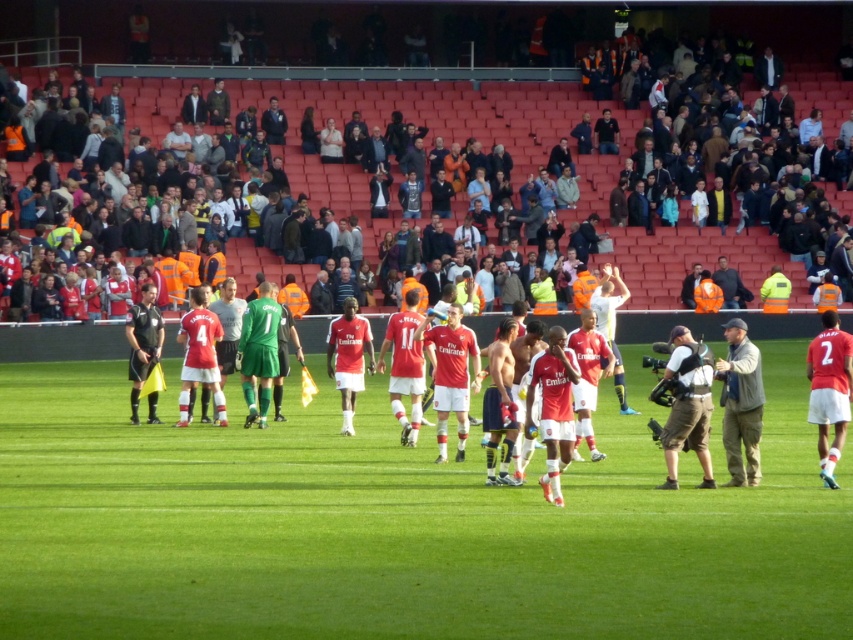
You are a photographer positioned at the edge of the field. You want to take a photo that includes both the green grass field at center and the gray fabric jacket at right. Which object will appear larger in your photo?

The green grass field at center will appear larger in the photo because it is closer to the viewer than the gray fabric jacket at right.

You are standing at the point labeled as point (683, 413). You need to throw a ball to someone exactly 16.62 meters away from you. Is there a player or object in the scene that is exactly that distance away?

Yes, the point labeled as point (683, 413) is exactly 16.62 meters away from you.